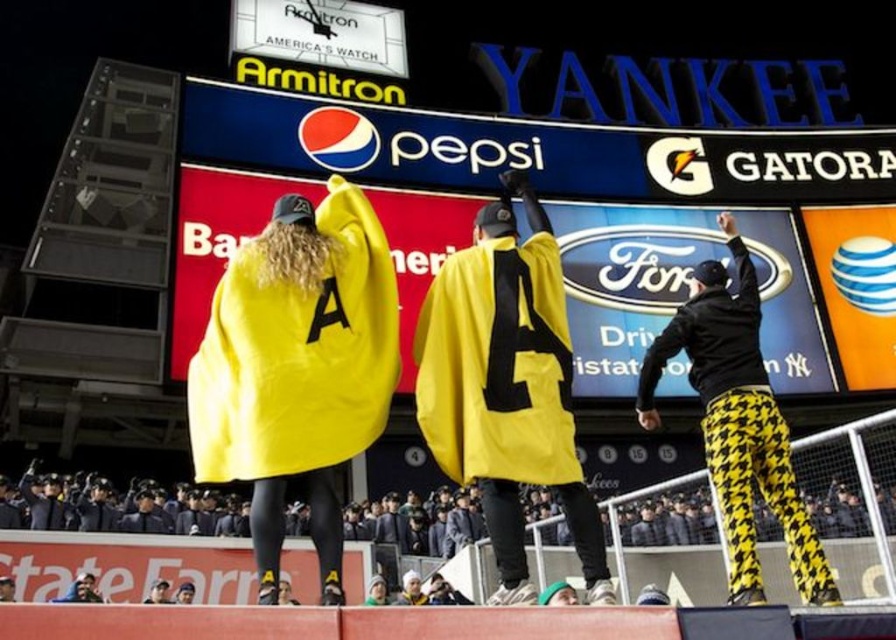
Question: Which object appears closest to the camera in this image?

Choices:
 (A) yellow matte cape at center
 (B) black houndstooth pants at right

Answer: (A)

Question: Is yellow matte cape at center to the left of black houndstooth pants at right from the viewer's perspective?

Choices:
 (A) yes
 (B) no

Answer: (A)

Question: Considering the relative positions of yellow fabric cape at center and black houndstooth pants at right in the image provided, where is yellow fabric cape at center located with respect to black houndstooth pants at right?

Choices:
 (A) left
 (B) right

Answer: (A)

Question: Among these objects, which one is farthest from the camera?

Choices:
 (A) black houndstooth pants at right
 (B) yellow matte cape at center
 (C) yellow fabric cape at center

Answer: (A)

Question: Does yellow fabric cape at center have a lesser width compared to yellow matte cape at center?

Choices:
 (A) no
 (B) yes

Answer: (A)

Question: Considering the real-world distances, which object is closest to the black houndstooth pants at right?

Choices:
 (A) yellow fabric cape at center
 (B) yellow matte cape at center

Answer: (B)